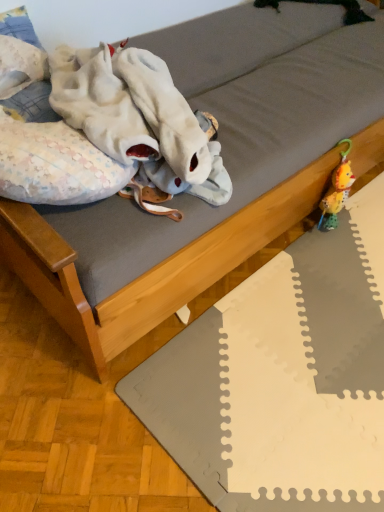
Where is `vacant region under gray foam puzzle mat at lower right (from a real-world perspective)`? vacant region under gray foam puzzle mat at lower right (from a real-world perspective) is located at coordinates pyautogui.click(x=307, y=364).